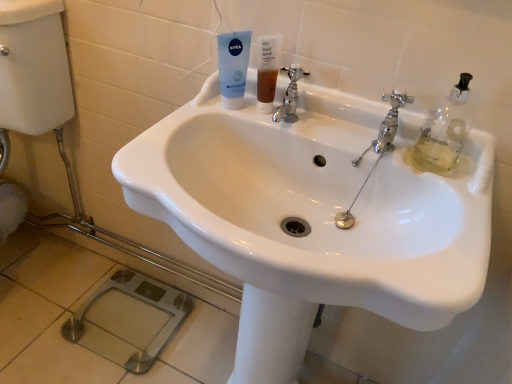
Question: Is blue matte tube at upper center inside the boundaries of chrome metallic faucet at upper right, which ranks as the 2th tap in left-to-right order, or outside?

Choices:
 (A) outside
 (B) inside

Answer: (A)

Question: Is blue matte tube at upper center bigger or smaller than chrome metallic faucet at upper right, which ranks as the 2th tap in left-to-right order?

Choices:
 (A) big
 (B) small

Answer: (A)

Question: Considering the real-world distances, which object is farthest from the white glossy sink at center?

Choices:
 (A) blue matte tube at upper center
 (B) translucent amber liquid at sink center
 (C) chrome metallic faucet at center, which is the 2th tap in right-to-left order
 (D) chrome metallic faucet at upper right, the first tap from the right

Answer: (B)

Question: Which object is positioned farthest from the blue matte tube at upper center?

Choices:
 (A) translucent amber liquid at sink center
 (B) chrome metallic faucet at upper right, which ranks as the 2th tap in left-to-right order
 (C) chrome metallic faucet at center, which is the 2th tap in right-to-left order
 (D) white glossy sink at center

Answer: (D)